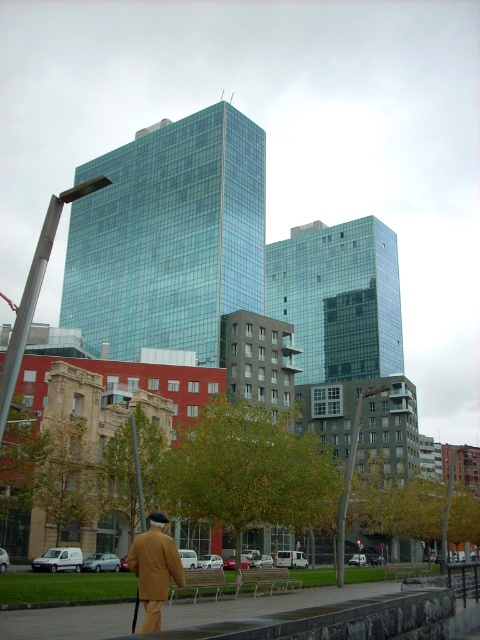
Question: Which object is farther from the camera taking this photo?

Choices:
 (A) gray concrete bench at lower center
 (B) brown woolen coat at lower left

Answer: (A)

Question: Which object is farther from the camera taking this photo?

Choices:
 (A) brown woolen coat at lower left
 (B) gray concrete bench at lower center

Answer: (B)

Question: Which object is closer to the camera taking this photo?

Choices:
 (A) brown woolen coat at lower left
 (B) gray concrete bench at lower center

Answer: (A)

Question: Does gray concrete bench at lower center have a larger size compared to brown woolen coat at lower left?

Choices:
 (A) yes
 (B) no

Answer: (A)

Question: Does gray concrete bench at lower center lie in front of brown woolen coat at lower left?

Choices:
 (A) no
 (B) yes

Answer: (A)

Question: Is gray concrete bench at lower center above brown woolen coat at lower left?

Choices:
 (A) yes
 (B) no

Answer: (B)